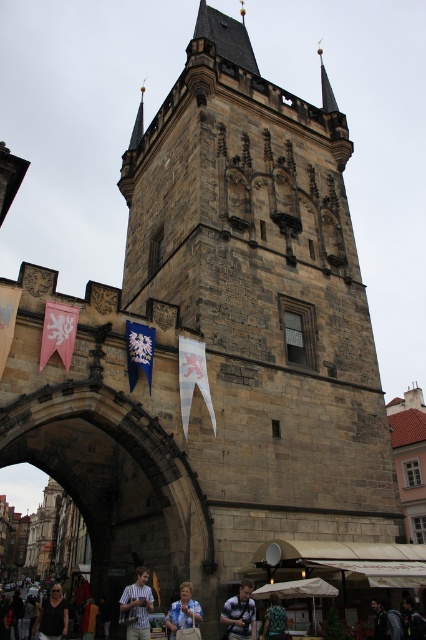
Question: Observing the image, what is the correct spatial positioning of blue fabric flag at center in reference to dark gray sweater at lower left?

Choices:
 (A) below
 (B) above

Answer: (B)

Question: Which point appears farthest from the camera in this image?

Choices:
 (A) (x=100, y=467)
 (B) (x=43, y=352)
 (C) (x=382, y=627)
 (D) (x=131, y=592)

Answer: (A)

Question: Estimate the real-world distances between objects in this image. Which object is closer to the light blue shirt at center?

Choices:
 (A) camouflage jacket at center
 (B) green fabric jacket at lower right
 (C) white fabric flag at center
 (D) blue fabric flag at center

Answer: (A)

Question: Which object appears farthest from the camera in this image?

Choices:
 (A) orange fabric bag at lower left
 (B) camouflage jacket at center
 (C) light brown wood shirt at center
 (D) light blue shirt at center

Answer: (A)

Question: Is the position of dark blue backpack at center less distant than that of green fabric jacket at lower right?

Choices:
 (A) no
 (B) yes

Answer: (A)

Question: In this image, where is striped shirt at center located relative to green fabric jacket at lower right?

Choices:
 (A) right
 (B) left

Answer: (B)